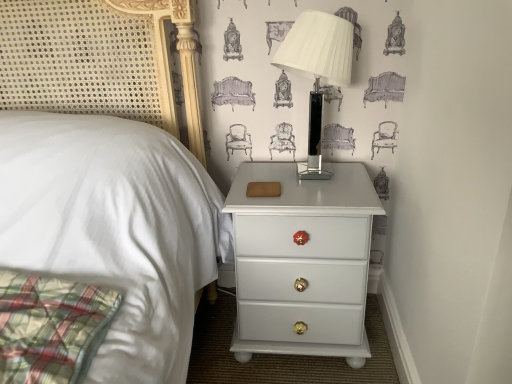
Question: Is white glossy table lamp at upper right oriented away from white glossy nightstand at lower right?

Choices:
 (A) yes
 (B) no

Answer: (B)

Question: Does white glossy table lamp at upper right appear on the right side of white glossy nightstand at lower right?

Choices:
 (A) no
 (B) yes

Answer: (B)

Question: From the image's perspective, would you say white glossy table lamp at upper right is positioned over white glossy nightstand at lower right?

Choices:
 (A) no
 (B) yes

Answer: (B)

Question: From a real-world perspective, is white glossy table lamp at upper right located higher than white glossy nightstand at lower right?

Choices:
 (A) no
 (B) yes

Answer: (B)

Question: From the image's perspective, would you say white glossy table lamp at upper right is shown under white glossy nightstand at lower right?

Choices:
 (A) no
 (B) yes

Answer: (A)

Question: Is white glossy table lamp at upper right further to camera compared to white glossy nightstand at lower right?

Choices:
 (A) yes
 (B) no

Answer: (B)

Question: Does white glossy nightstand at lower right have a larger size compared to white glossy table lamp at upper right?

Choices:
 (A) yes
 (B) no

Answer: (A)

Question: Is white glossy nightstand at lower right touching white glossy table lamp at upper right?

Choices:
 (A) no
 (B) yes

Answer: (A)

Question: Does white glossy nightstand at lower right have a lesser height compared to white glossy table lamp at upper right?

Choices:
 (A) no
 (B) yes

Answer: (A)

Question: Does white glossy nightstand at lower right appear on the right side of white glossy table lamp at upper right?

Choices:
 (A) no
 (B) yes

Answer: (A)

Question: Is white glossy nightstand at lower right taller than white glossy table lamp at upper right?

Choices:
 (A) yes
 (B) no

Answer: (A)

Question: Would you say white glossy nightstand at lower right is a long distance from white glossy table lamp at upper right?

Choices:
 (A) no
 (B) yes

Answer: (A)

Question: Is point (329, 354) positioned closer to the camera than point (297, 49)?

Choices:
 (A) closer
 (B) farther

Answer: (B)